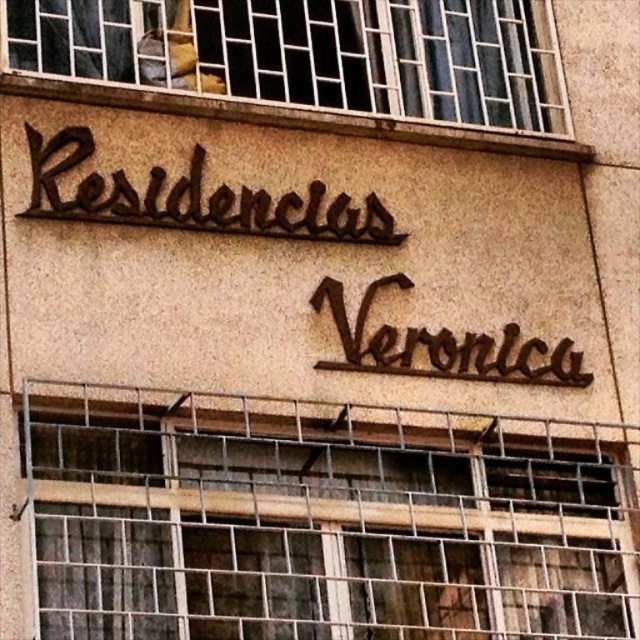
Question: Considering the real-world distances, which object is farthest from the denim jacket at upper left?

Choices:
 (A) brown metallic sign at upper center
 (B) metallic bars at upper center

Answer: (A)

Question: Is metallic grid at center further to camera compared to brown metallic sign at upper center?

Choices:
 (A) no
 (B) yes

Answer: (A)

Question: Which object appears farthest from the camera in this image?

Choices:
 (A) denim jacket at upper left
 (B) dark brown metal sign at center

Answer: (A)

Question: Which of the following is the farthest from the observer?

Choices:
 (A) denim jacket at upper left
 (B) brown metallic sign at upper center
 (C) metallic grid at center
 (D) metallic bars at upper center

Answer: (A)

Question: Can you confirm if metallic bars at upper center is positioned below denim jacket at upper left?

Choices:
 (A) no
 (B) yes

Answer: (B)

Question: Is metallic grid at center smaller than brown metallic sign at upper center?

Choices:
 (A) yes
 (B) no

Answer: (B)